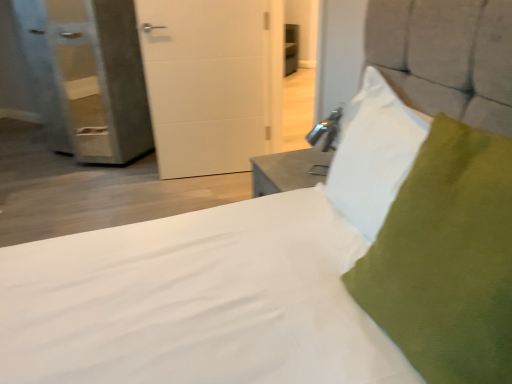
What do you see at coordinates (447, 259) in the screenshot? I see `green fabric pillow at upper right, placed as the second pillow when sorted from back to front` at bounding box center [447, 259].

This screenshot has height=384, width=512. In order to click on green fabric pillow at upper right, placed as the second pillow when sorted from back to front in this screenshot , I will do `click(447, 259)`.

Are textured gray pillow at upper right, the 2th pillow when ordered from front to back, and green fabric pillow at upper right, acting as the first pillow starting from the front, beside each other?

textured gray pillow at upper right, the 2th pillow when ordered from front to back, and green fabric pillow at upper right, acting as the first pillow starting from the front, are not in contact.

Is textured gray pillow at upper right, which ranks as the 1th pillow in back-to-front order, wider or thinner than green fabric pillow at upper right, acting as the first pillow starting from the front?

In the image, textured gray pillow at upper right, which ranks as the 1th pillow in back-to-front order, appears to be more narrow than green fabric pillow at upper right, acting as the first pillow starting from the front.

Locate an element on the screen. pillow located below the textured gray pillow at upper right, which ranks as the 1th pillow in back-to-front order (from the image's perspective) is located at coordinates (447, 259).

Does white matte door at center turn towards textured gray pillow at upper right, the 2th pillow when ordered from front to back?

Yes, white matte door at center is aimed at textured gray pillow at upper right, the 2th pillow when ordered from front to back.

Which is more to the right, white matte door at center or textured gray pillow at upper right, which ranks as the 1th pillow in back-to-front order?

Positioned to the right is textured gray pillow at upper right, which ranks as the 1th pillow in back-to-front order.

Between white matte door at center and textured gray pillow at upper right, the 2th pillow when ordered from front to back, which one has more height?

white matte door at center.

From a real-world perspective, is white matte door at center under textured gray pillow at upper right, which ranks as the 1th pillow in back-to-front order?

Yes, from a real-world perspective, white matte door at center is below textured gray pillow at upper right, which ranks as the 1th pillow in back-to-front order.

Looking at the image, does green fabric pillow at upper right, acting as the first pillow starting from the front, seem bigger or smaller compared to textured gray pillow at upper right, which ranks as the 1th pillow in back-to-front order?

Clearly, green fabric pillow at upper right, acting as the first pillow starting from the front, is larger in size than textured gray pillow at upper right, which ranks as the 1th pillow in back-to-front order.

Based on the photo, from the image's perspective, is green fabric pillow at upper right, placed as the second pillow when sorted from back to front, located beneath textured gray pillow at upper right, the 2th pillow when ordered from front to back?

Yes.

In terms of height, does green fabric pillow at upper right, acting as the first pillow starting from the front, look taller or shorter compared to textured gray pillow at upper right, which ranks as the 1th pillow in back-to-front order?

Clearly, green fabric pillow at upper right, acting as the first pillow starting from the front, is taller compared to textured gray pillow at upper right, which ranks as the 1th pillow in back-to-front order.

Based on the photo, considering the relative positions of green fabric pillow at upper right, acting as the first pillow starting from the front, and textured gray pillow at upper right, the 2th pillow when ordered from front to back, in the image provided, is green fabric pillow at upper right, acting as the first pillow starting from the front, in front of textured gray pillow at upper right, the 2th pillow when ordered from front to back,?

Yes, it is.

In the scene shown: Considering the sizes of objects textured gray pillow at upper right, the 2th pillow when ordered from front to back, and white matte door at center in the image provided, who is thinner, textured gray pillow at upper right, the 2th pillow when ordered from front to back, or white matte door at center?

white matte door at center.

Measure the distance between textured gray pillow at upper right, the 2th pillow when ordered from front to back, and white matte door at center.

A distance of 1.56 meters exists between textured gray pillow at upper right, the 2th pillow when ordered from front to back, and white matte door at center.

Where is `the 1st pillow in front when counting from the white matte door at center`? The width and height of the screenshot is (512, 384). the 1st pillow in front when counting from the white matte door at center is located at coordinates (373, 153).

Does textured gray pillow at upper right, which ranks as the 1th pillow in back-to-front order, turn towards white matte door at center?

No, textured gray pillow at upper right, which ranks as the 1th pillow in back-to-front order, is not facing towards white matte door at center.

Considering the relative sizes of green fabric pillow at upper right, placed as the second pillow when sorted from back to front, and white matte door at center in the image provided, is green fabric pillow at upper right, placed as the second pillow when sorted from back to front, shorter than white matte door at center?

Yes, green fabric pillow at upper right, placed as the second pillow when sorted from back to front, is shorter than white matte door at center.

Is green fabric pillow at upper right, acting as the first pillow starting from the front, at the right side of white matte door at center?

Correct, you'll find green fabric pillow at upper right, acting as the first pillow starting from the front, to the right of white matte door at center.

The height and width of the screenshot is (384, 512). In order to click on the 2nd pillow counting from the right side of the white matte door at center in this screenshot , I will do `click(447, 259)`.

Are white matte door at center and green fabric pillow at upper right, acting as the first pillow starting from the front, far apart?

Yes.

There is a white matte door at center. At what (x,y) coordinates should I click in order to perform the action: click on the 1st pillow above it (from a real-world perspective). Please return your answer as a coordinate pair (x, y). Looking at the image, I should click on (447, 259).

Between white matte door at center and green fabric pillow at upper right, placed as the second pillow when sorted from back to front, which one has larger width?

green fabric pillow at upper right, placed as the second pillow when sorted from back to front.

From a real-world perspective, is white matte door at center positioned above or below green fabric pillow at upper right, placed as the second pillow when sorted from back to front?

In terms of real-world spatial position, white matte door at center is below green fabric pillow at upper right, placed as the second pillow when sorted from back to front.

This screenshot has height=384, width=512. I want to click on pillow lying below the textured gray pillow at upper right, the 2th pillow when ordered from front to back (from the image's perspective), so click(447, 259).

Locate an element on the screen. This screenshot has height=384, width=512. door below the textured gray pillow at upper right, which ranks as the 1th pillow in back-to-front order (from a real-world perspective) is located at coordinates (212, 82).

Considering their positions, is green fabric pillow at upper right, placed as the second pillow when sorted from back to front, positioned closer to textured gray pillow at upper right, which ranks as the 1th pillow in back-to-front order, than white matte door at center?

The object closer to textured gray pillow at upper right, which ranks as the 1th pillow in back-to-front order, is green fabric pillow at upper right, placed as the second pillow when sorted from back to front.

From the image, which object appears to be nearer to green fabric pillow at upper right, acting as the first pillow starting from the front, white matte door at center or textured gray pillow at upper right, which ranks as the 1th pillow in back-to-front order?

The object closer to green fabric pillow at upper right, acting as the first pillow starting from the front, is textured gray pillow at upper right, which ranks as the 1th pillow in back-to-front order.

When comparing their distances from textured gray pillow at upper right, which ranks as the 1th pillow in back-to-front order, does white matte door at center or green fabric pillow at upper right, placed as the second pillow when sorted from back to front, seem closer?

green fabric pillow at upper right, placed as the second pillow when sorted from back to front, is closer to textured gray pillow at upper right, which ranks as the 1th pillow in back-to-front order.

Looking at the image, which one is located closer to white matte door at center, textured gray pillow at upper right, the 2th pillow when ordered from front to back, or green fabric pillow at upper right, placed as the second pillow when sorted from back to front?

textured gray pillow at upper right, the 2th pillow when ordered from front to back, is positioned closer to the anchor white matte door at center.

Consider the image. Which object lies nearer to the anchor point green fabric pillow at upper right, acting as the first pillow starting from the front, textured gray pillow at upper right, the 2th pillow when ordered from front to back, or white matte door at center?

The object closer to green fabric pillow at upper right, acting as the first pillow starting from the front, is textured gray pillow at upper right, the 2th pillow when ordered from front to back.

From the image, which object appears to be farther from white matte door at center, green fabric pillow at upper right, placed as the second pillow when sorted from back to front, or textured gray pillow at upper right, the 2th pillow when ordered from front to back?

green fabric pillow at upper right, placed as the second pillow when sorted from back to front, is positioned further to the anchor white matte door at center.

This screenshot has width=512, height=384. I want to click on pillow positioned between green fabric pillow at upper right, acting as the first pillow starting from the front, and white matte door at center from near to far, so click(373, 153).